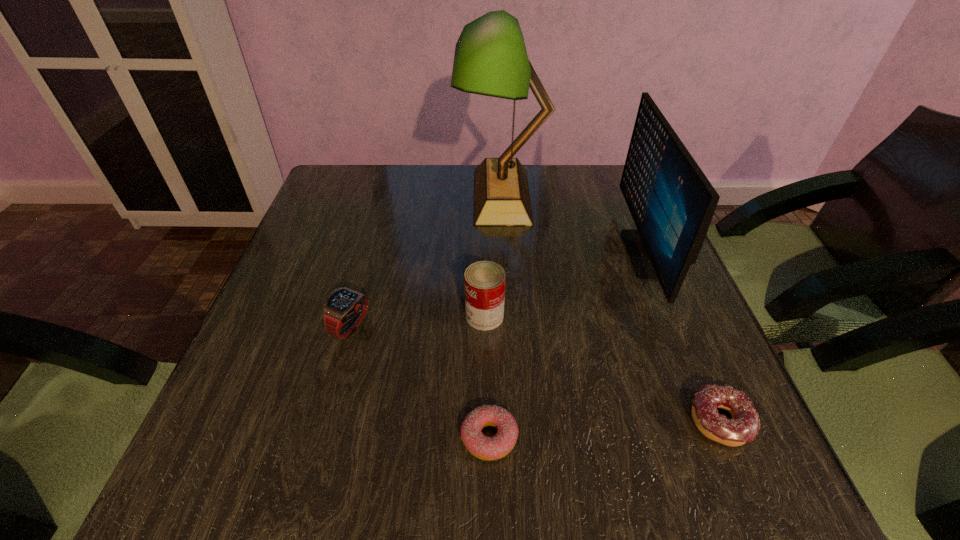
This screenshot has height=540, width=960. I want to click on vacant space that is in between the second tallest object and the tallest object, so 574,225.

You are a GUI agent. You are given a task and a screenshot of the screen. Output one action in this format:
    pyautogui.click(x=<x>, y=<y>)
    Task: Click on the vacant point located between the second tallest object and the shorter doughnut
    This screenshot has height=540, width=960.
    Given the screenshot: What is the action you would take?
    pyautogui.click(x=568, y=345)

Locate an element on the screen. The height and width of the screenshot is (540, 960). vacant space that's between the computer monitor and the shortest object is located at coordinates (568, 345).

Locate an element on the screen. This screenshot has height=540, width=960. vacant space that is in between the right doughnut and the tallest object is located at coordinates (612, 308).

Locate which object ranks fifth in proximity to the fifth tallest object. Please provide its 2D coordinates. Your answer should be formatted as a tuple, i.e. [(x, y)], where the tuple contains the x and y coordinates of a point satisfying the conditions above.

[(344, 308)]

This screenshot has width=960, height=540. I want to click on object that stands as the third closest to the table lamp, so click(x=344, y=308).

Identify the location of vacant space that satisfies the following two spatial constraints: 1. on the front label of the can; 2. on the front side of the third shortest object. Image resolution: width=960 pixels, height=540 pixels. (485, 326).

You are a GUI agent. You are given a task and a screenshot of the screen. Output one action in this format:
    pyautogui.click(x=<x>, y=<y>)
    Task: Click on the vacant region that satisfies the following two spatial constraints: 1. on the back side of the taller doughnut; 2. on the right side of the shorter doughnut
    Image resolution: width=960 pixels, height=540 pixels.
    Given the screenshot: What is the action you would take?
    pyautogui.click(x=490, y=421)

This screenshot has height=540, width=960. Identify the location of free location that satisfies the following two spatial constraints: 1. on the metallic stand of the second shortest object; 2. on the left side of the table lamp. (516, 421).

Identify the location of vacant space that satisfies the following two spatial constraints: 1. on the back side of the shorter doughnut; 2. on the front label of the can. This screenshot has height=540, width=960. (488, 316).